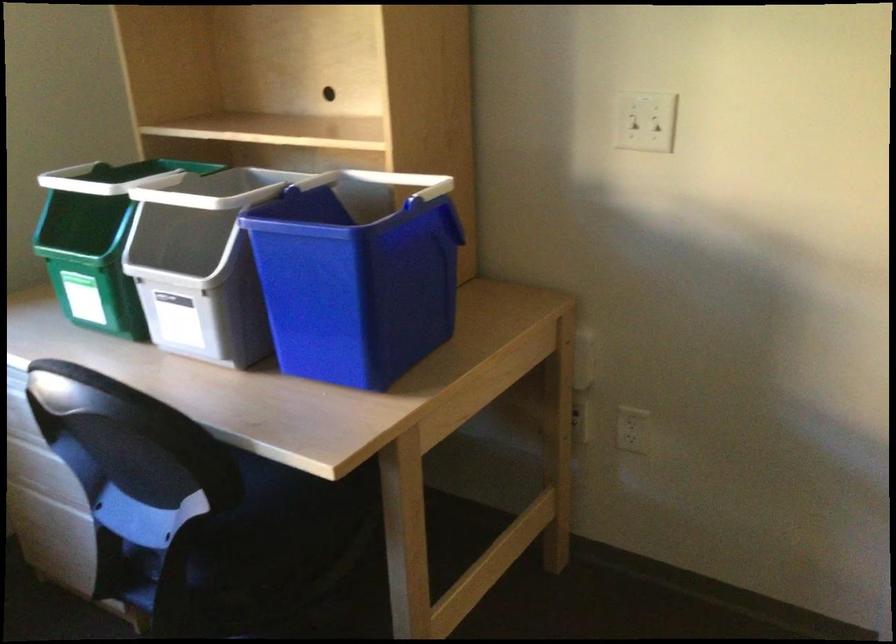
What do you see at coordinates (245, 185) in the screenshot? The image size is (896, 644). I see `a grey bin handle` at bounding box center [245, 185].